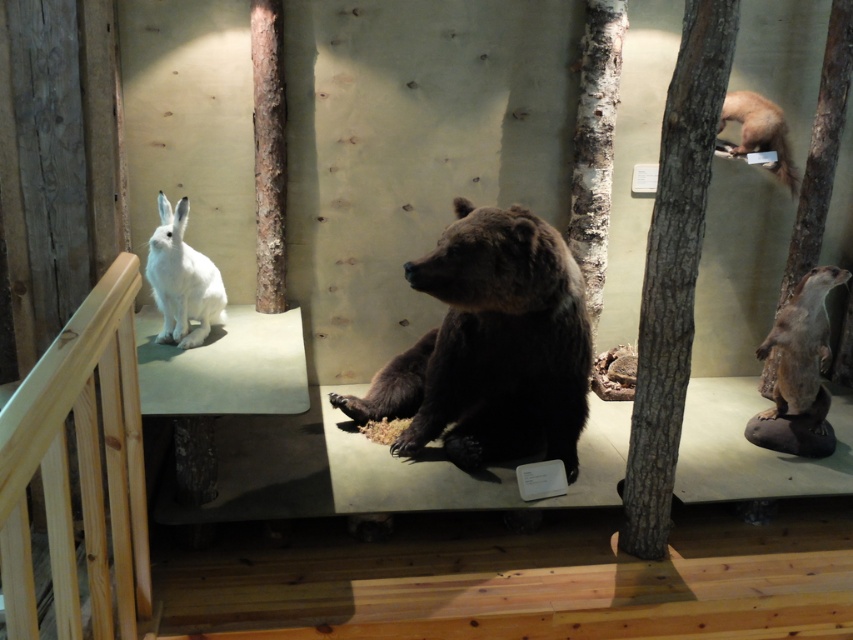
Is brown fur bear at center above white fur rabbit at upper right?

Actually, brown fur bear at center is below white fur rabbit at upper right.

You are a GUI agent. You are given a task and a screenshot of the screen. Output one action in this format:
    pyautogui.click(x=<x>, y=<y>)
    Task: Click on the brown fur bear at center
    
    Given the screenshot: What is the action you would take?
    pyautogui.click(x=491, y=346)

Locate an element on the screen. brown fur bear at center is located at coordinates (491, 346).

At what (x,y) coordinates should I click in order to perform the action: click on brown fur bear at center. Please return your answer as a coordinate pair (x, y). Looking at the image, I should click on (491, 346).

From the picture: Can you confirm if white fur otter at right is bigger than white fur rabbit at upper right?

Indeed, white fur otter at right has a larger size compared to white fur rabbit at upper right.

Identify the location of white fur otter at right. (802, 348).

Between brown fur bear at center and white fur rabbit at left, which one is positioned lower?

brown fur bear at center is below.

Which of these two, brown fur bear at center or white fur rabbit at left, stands taller?

With more height is brown fur bear at center.

Locate an element on the screen. This screenshot has width=853, height=640. brown fur bear at center is located at coordinates [x=491, y=346].